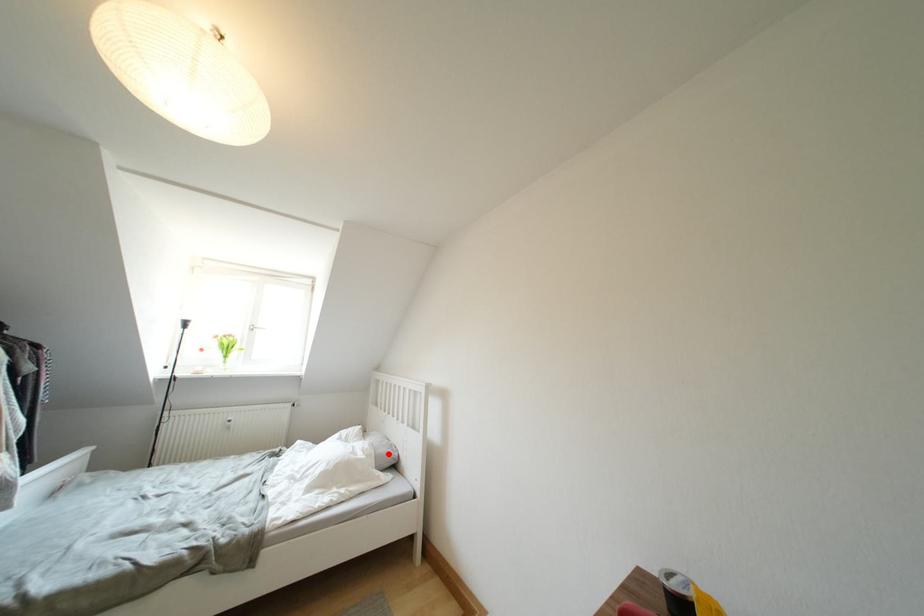
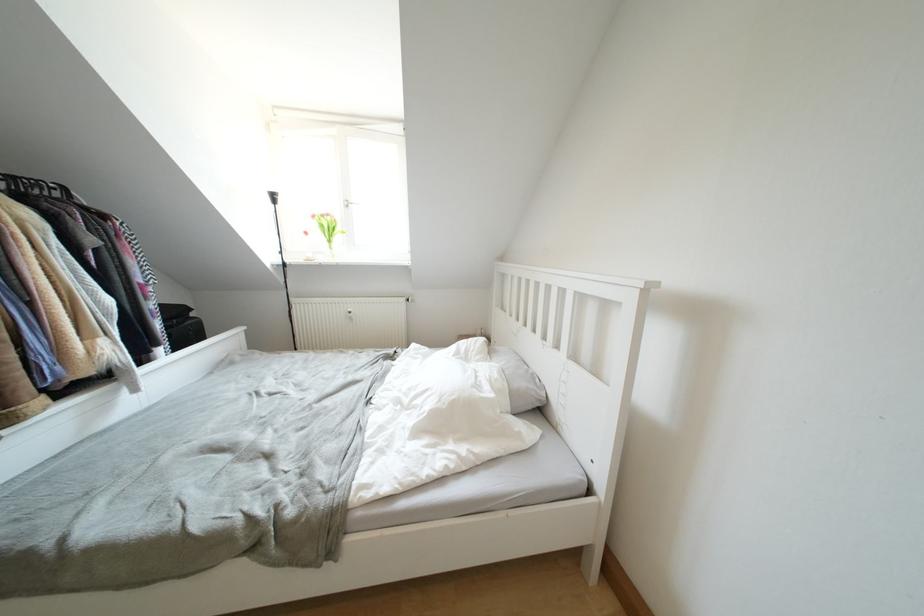
In the second image, find the point that corresponds to the highlighted location in the first image.

(527, 387)